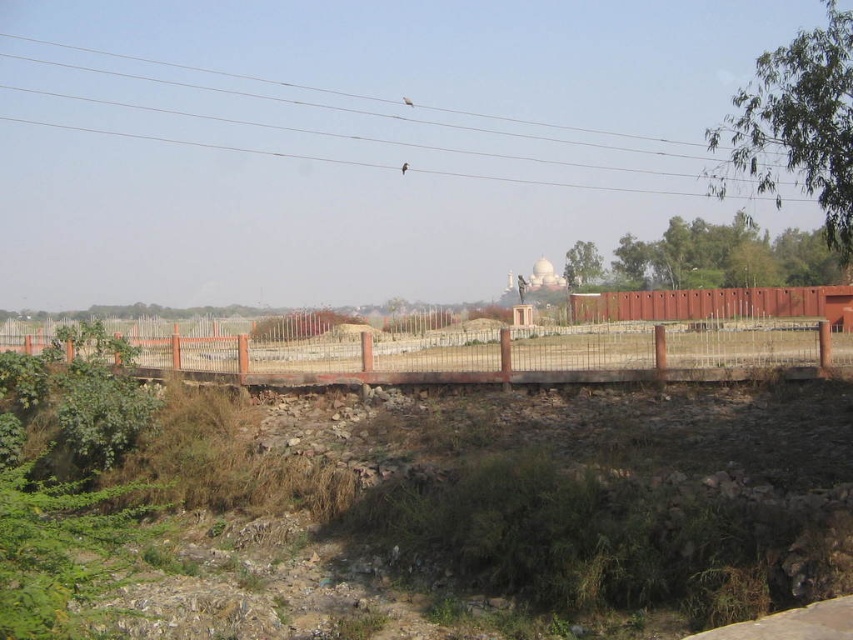
You are a painter setting up an easel to capture the rural landscape. You notice the smooth wire at upper center and the brick wall at center. Which object should you focus on if you want to paint the wider feature in the scene?

The smooth wire at upper center should be focused on because its width surpasses that of the brick wall at center.

You are a bird flying over the landscape and want to land on a spot that is not too big to rest. Which object between the smooth wire at upper center and the brick wall at center would you choose?

The brick wall at center has a smaller size compared to the smooth wire at upper center, so the bird should choose the brick wall at center to land since it provides a more stable and spacious area for resting.

You are a hiker carrying a 50 feet long rope. You want to secure your gear on the orange metal fence at center. Can you determine if your rope is long enough to reach from where you are standing to the fence?

The orange metal fence at center is 49.65 feet away from the viewer. Since the rope is 50 feet long, it is long enough to reach the fence.